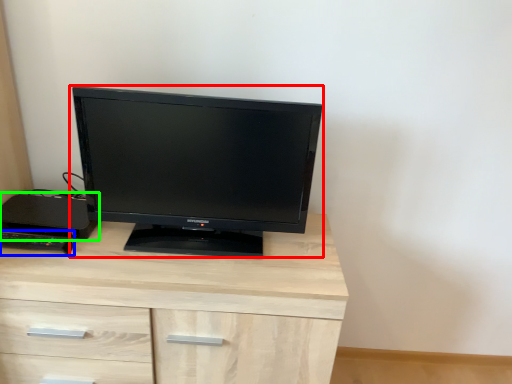
Question: Considering the real-world distances, which object is farthest from computer monitor (highlighted by a red box)? desktop (highlighted by a blue box) or desktop (highlighted by a green box)?

Choices:
 (A) desktop
 (B) desktop

Answer: (A)